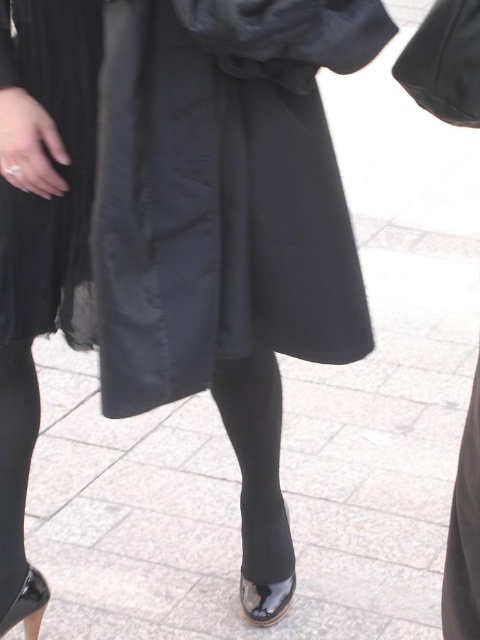
Question: Can you confirm if matte black dress at lower left is smaller than glossy patent leather sandal at lower center?

Choices:
 (A) yes
 (B) no

Answer: (B)

Question: Is black tights at lower left closer to the viewer compared to glossy patent leather sandal at lower center?

Choices:
 (A) no
 (B) yes

Answer: (B)

Question: Which point is farther to the camera?

Choices:
 (A) (181, 99)
 (B) (71, 333)

Answer: (B)

Question: Which point is farther to the camera?

Choices:
 (A) (44, 584)
 (B) (4, 387)
 (C) (13, 273)
 (D) (274, 180)

Answer: (A)

Question: Among these objects, which one is farthest from the camera?

Choices:
 (A) glossy patent leather sandal at lower left
 (B) matte black dress at lower left
 (C) glossy patent leather sandal at lower center

Answer: (C)

Question: Does matte black dress at lower left have a lesser width compared to glossy patent leather sandal at lower left?

Choices:
 (A) no
 (B) yes

Answer: (A)